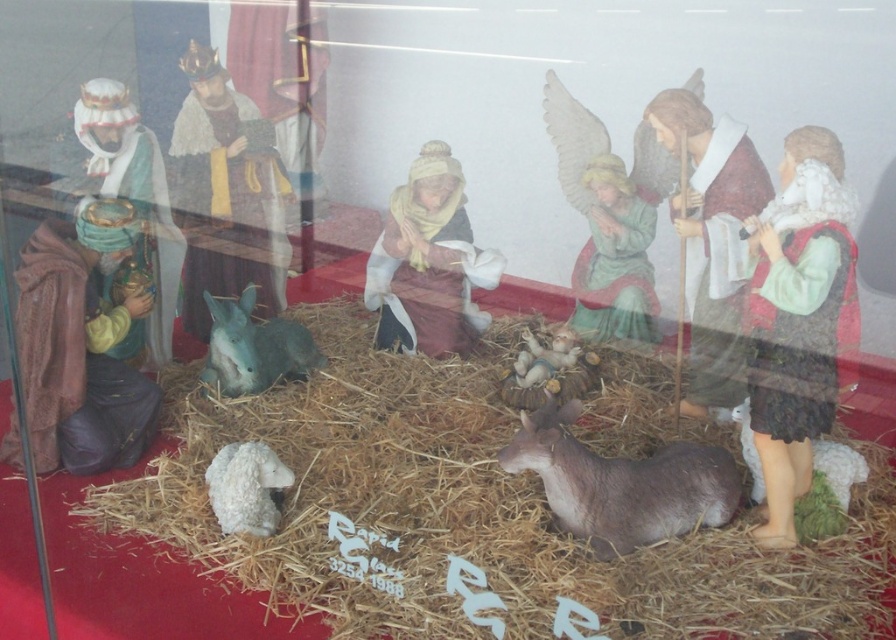
Question: Which of the following is the farthest from the observer?

Choices:
 (A) white woolen lamb at lower left
 (B) fuzzy brown donkey at lower center
 (C) smooth beige baby at center

Answer: (C)

Question: Which is nearer to the fuzzy brown donkey at lower center?

Choices:
 (A) gray matte donkey at center
 (B) white woolen lamb at lower right

Answer: (B)

Question: Is gray matte donkey at center to the right of white woolen lamb at lower left from the viewer's perspective?

Choices:
 (A) no
 (B) yes

Answer: (A)

Question: Estimate the real-world distances between objects in this image. Which object is farther from the fuzzy brown donkey at lower center?

Choices:
 (A) gray matte donkey at center
 (B) smooth beige baby at center
 (C) white woolen lamb at lower right
 (D) white woolen lamb at lower left

Answer: (A)

Question: Can you confirm if gray matte donkey at center is positioned above white woolen lamb at lower left?

Choices:
 (A) yes
 (B) no

Answer: (A)

Question: Can you confirm if fuzzy brown donkey at lower center is wider than white woolen lamb at lower left?

Choices:
 (A) yes
 (B) no

Answer: (A)